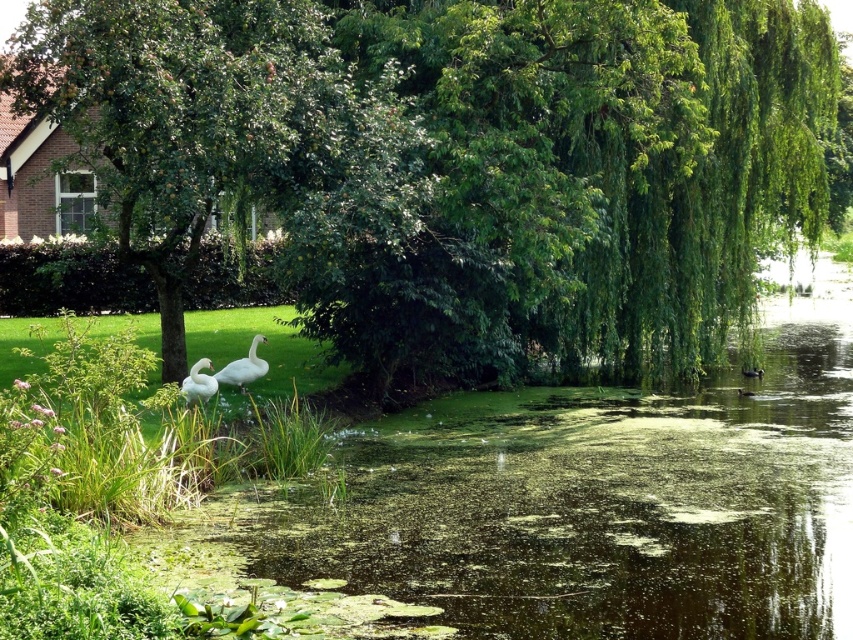
You are a birdwatcher observing the scene from the edge of the pond. You notice the green leafy tree at center and the white feathered swan at lower left. Which object is taller?

The green leafy tree at center is taller than the white feathered swan at lower left according to the description.

You are standing at the edge of the pond and want to take a photo of the green leafy tree at center. If your camera has a maximum zoom range of 10 meters, will you be able to capture the tree clearly without moving closer?

The green leafy tree at center is 12.63 meters away from the camera. Since the camera can only zoom up to 10 meters, you won cannot capture the tree clearly without moving closer.